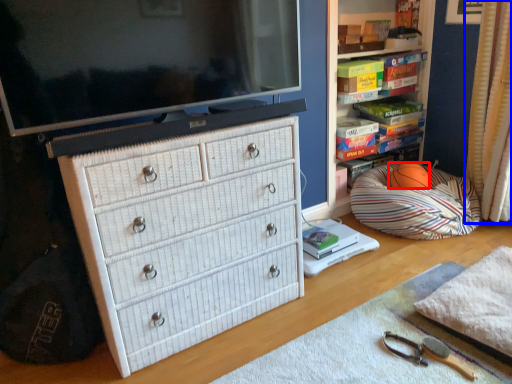
Question: Among these objects, which one is nearest to the camera, ball (highlighted by a red box) or curtain (highlighted by a blue box)?

Choices:
 (A) ball
 (B) curtain

Answer: (B)